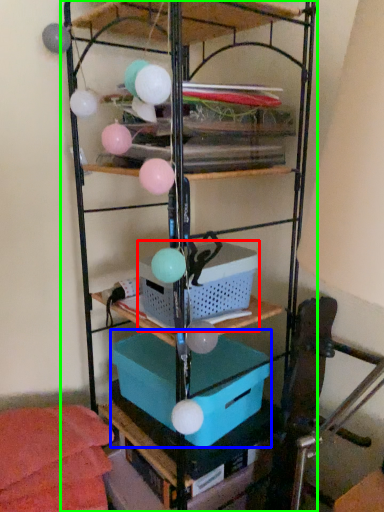
Question: Which object is the farthest from basket (highlighted by a red box)? Choose among these: box (highlighted by a blue box) or shelf (highlighted by a green box).

Choices:
 (A) box
 (B) shelf

Answer: (A)